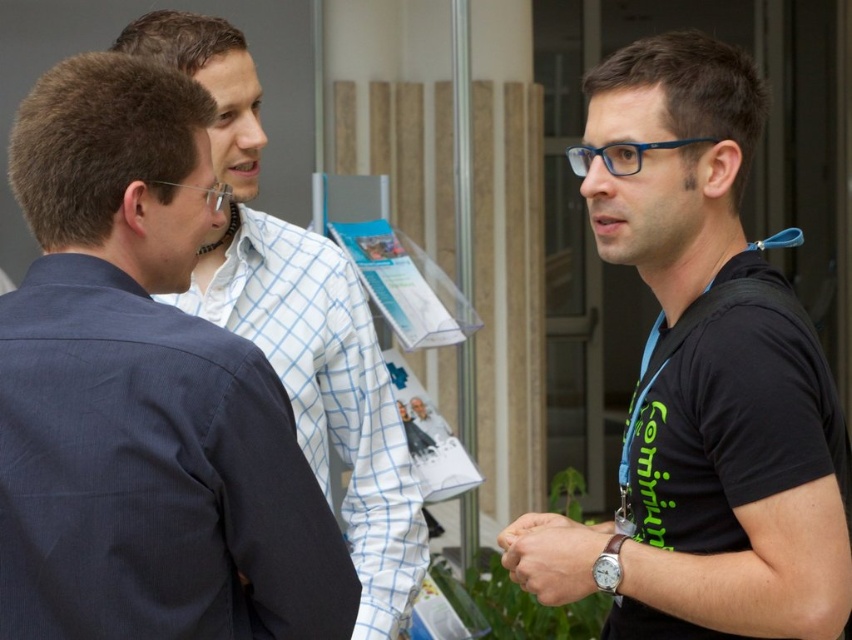
You are a photographer trying to capture a closeup of the leather wristwatch at lower right without including the blue fabric lanyard at right in the shot. Based on their positions, can you do this?

Yes, because the leather wristwatch at lower right is closer to the viewer than the blue fabric lanyard at right, so adjusting the camera angle to focus on the closer wristwatch while excluding the lanyard behind it is possible.

You are standing in front of the group of three people near the building entrance. You need to deliver a message to the person at point (527, 586) and the person at point (639, 410). Which person should you approach first if you want to reach the closer one first?

You should approach the person at point (527, 586) first because it is closer to you than the person at point (639, 410).